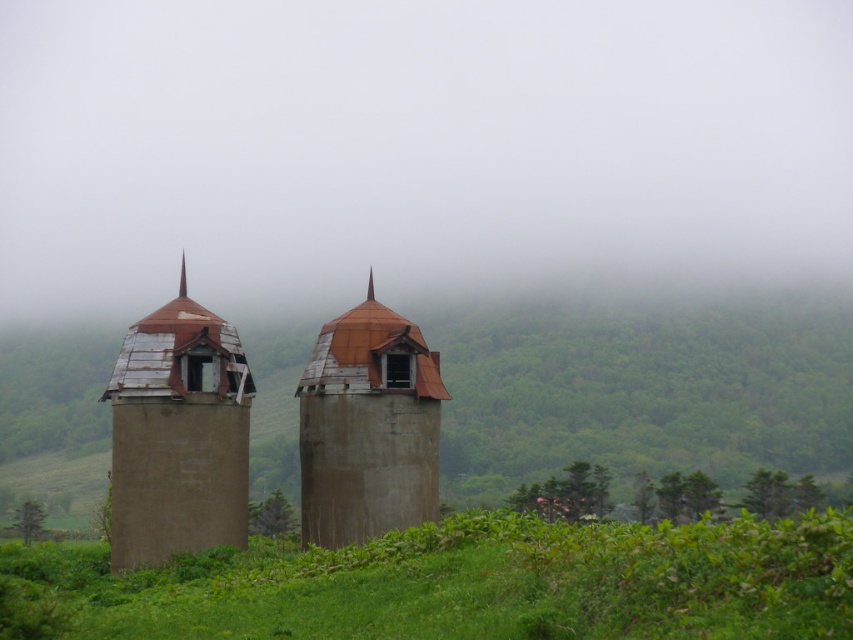
Can you confirm if green grassy at lower center is wider than rusty metal tower at left?

Yes.

What do you see at coordinates (457, 584) in the screenshot? I see `green grassy at lower center` at bounding box center [457, 584].

This screenshot has width=853, height=640. I want to click on green grassy at lower center, so click(x=457, y=584).

Is point (419, 12) closer to viewer compared to point (381, 577)?

No.

In the scene shown: Measure the distance between point (656, 52) and camera.

Point (656, 52) is 801.15 feet from camera.

Who is more forward, (358, 141) or (821, 572)?

Positioned in front is point (821, 572).

You are a GUI agent. You are given a task and a screenshot of the screen. Output one action in this format:
    pyautogui.click(x=<x>, y=<y>)
    Task: Click on the foggy sky at center
    The height and width of the screenshot is (640, 853).
    Given the screenshot: What is the action you would take?
    pyautogui.click(x=416, y=148)

Between point (831, 108) and point (83, 452), which one is positioned behind?

The point (831, 108) is more distant.

Does point (735, 221) come closer to viewer compared to point (102, 355)?

No, (735, 221) is further to viewer.

Where is `foggy sky at center`? This screenshot has height=640, width=853. foggy sky at center is located at coordinates (416, 148).